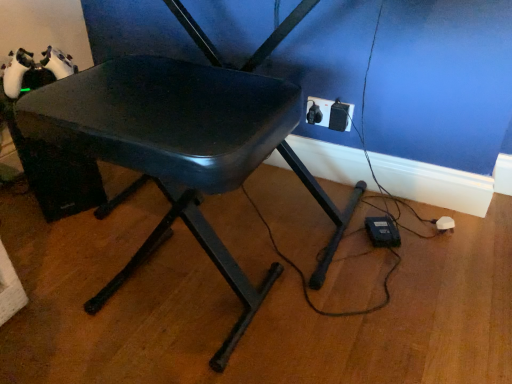
What is the approximate height of black plastic outlet at lower right?

10.62 centimeters.

What do you see at coordinates (329, 113) in the screenshot? This screenshot has width=512, height=384. I see `black plastic outlet at lower right` at bounding box center [329, 113].

Identify the location of black plastic outlet at lower right. This screenshot has height=384, width=512. (329, 113).

What do you see at coordinates (183, 143) in the screenshot? The width and height of the screenshot is (512, 384). I see `matte black chair at center` at bounding box center [183, 143].

I want to click on matte black chair at center, so click(x=183, y=143).

Image resolution: width=512 pixels, height=384 pixels. I want to click on black plastic outlet at lower right, so click(x=329, y=113).

Considering the positions of objects matte black chair at center and black plastic outlet at lower right in the image provided, who is more to the left, matte black chair at center or black plastic outlet at lower right?

Positioned to the left is matte black chair at center.

In the scene shown: Which object is more forward, matte black chair at center or black plastic outlet at lower right?

matte black chair at center is closer to the camera.

Considering the positions of points (125, 120) and (318, 117), is point (125, 120) farther from camera compared to point (318, 117)?

No.

From the image's perspective, relative to black plastic outlet at lower right, is matte black chair at center above or below?

matte black chair at center is situated lower than black plastic outlet at lower right in the image.

From a real-world perspective, is matte black chair at center physically above black plastic outlet at lower right?

Yes, from a real-world perspective, matte black chair at center is on top of black plastic outlet at lower right.

Can you confirm if matte black chair at center is wider than black plastic outlet at lower right?

Correct, the width of matte black chair at center exceeds that of black plastic outlet at lower right.

Does matte black chair at center have a lesser height compared to black plastic outlet at lower right?

No, matte black chair at center is not shorter than black plastic outlet at lower right.

Does matte black chair at center have a smaller size compared to black plastic outlet at lower right?

No, matte black chair at center is not smaller than black plastic outlet at lower right.

Is matte black chair at center outside of black plastic outlet at lower right?

matte black chair at center lies outside black plastic outlet at lower right's area.

Is matte black chair at center with black plastic outlet at lower right?

No, matte black chair at center is not with black plastic outlet at lower right.

Is matte black chair at center facing towards black plastic outlet at lower right?

No, matte black chair at center is not turned towards black plastic outlet at lower right.

Can you tell me how much matte black chair at center and black plastic outlet at lower right differ in facing direction?

They differ by 1.45 degrees in their facing directions.

Measure the distance from matte black chair at center to black plastic outlet at lower right.

matte black chair at center and black plastic outlet at lower right are 20.89 inches apart from each other.

Locate an element on the screen. Image resolution: width=512 pixels, height=384 pixels. electric outlet located underneath the matte black chair at center (from a real-world perspective) is located at coordinates [x=329, y=113].

In the scene shown: Is black plastic outlet at lower right to the left of matte black chair at center from the viewer's perspective?

Incorrect, black plastic outlet at lower right is not on the left side of matte black chair at center.

Which object is further away from the camera, black plastic outlet at lower right or matte black chair at center?

black plastic outlet at lower right is more distant.

Does point (337, 104) come closer to viewer compared to point (74, 78)?

No, (337, 104) is behind (74, 78).

From the image's perspective, which one is positioned higher, black plastic outlet at lower right or matte black chair at center?

black plastic outlet at lower right is shown above in the image.

From a real-world perspective, is black plastic outlet at lower right on top of matte black chair at center?

No, from a real-world perspective, black plastic outlet at lower right is not on top of matte black chair at center.

Between black plastic outlet at lower right and matte black chair at center, which one has smaller width?

black plastic outlet at lower right is thinner.

From their relative heights in the image, would you say black plastic outlet at lower right is taller or shorter than matte black chair at center?

Clearly, black plastic outlet at lower right is shorter compared to matte black chair at center.

Considering the sizes of black plastic outlet at lower right and matte black chair at center in the image, is black plastic outlet at lower right bigger or smaller than matte black chair at center?

Clearly, black plastic outlet at lower right is smaller in size than matte black chair at center.

Choose the correct answer: Is black plastic outlet at lower right inside matte black chair at center or outside it?

black plastic outlet at lower right is not enclosed by matte black chair at center.

Would you consider black plastic outlet at lower right to be distant from matte black chair at center?

They are positioned close to each other.

Could you tell me if black plastic outlet at lower right is facing matte black chair at center?

Yes, black plastic outlet at lower right is facing matte black chair at center.

What's the angular difference between black plastic outlet at lower right and matte black chair at center's facing directions?

The angle between the facing direction of black plastic outlet at lower right and the facing direction of matte black chair at center is 1.45 degrees.

How much distance is there between black plastic outlet at lower right and matte black chair at center?

black plastic outlet at lower right and matte black chair at center are 20.89 inches apart.

The width and height of the screenshot is (512, 384). Find the location of `chair above the black plastic outlet at lower right (from a real-world perspective)`. chair above the black plastic outlet at lower right (from a real-world perspective) is located at coordinates (183, 143).

The image size is (512, 384). Identify the location of electric outlet on the right of matte black chair at center. (329, 113).

The height and width of the screenshot is (384, 512). Find the location of `chair located below the black plastic outlet at lower right (from the image's perspective)`. chair located below the black plastic outlet at lower right (from the image's perspective) is located at coordinates (183, 143).